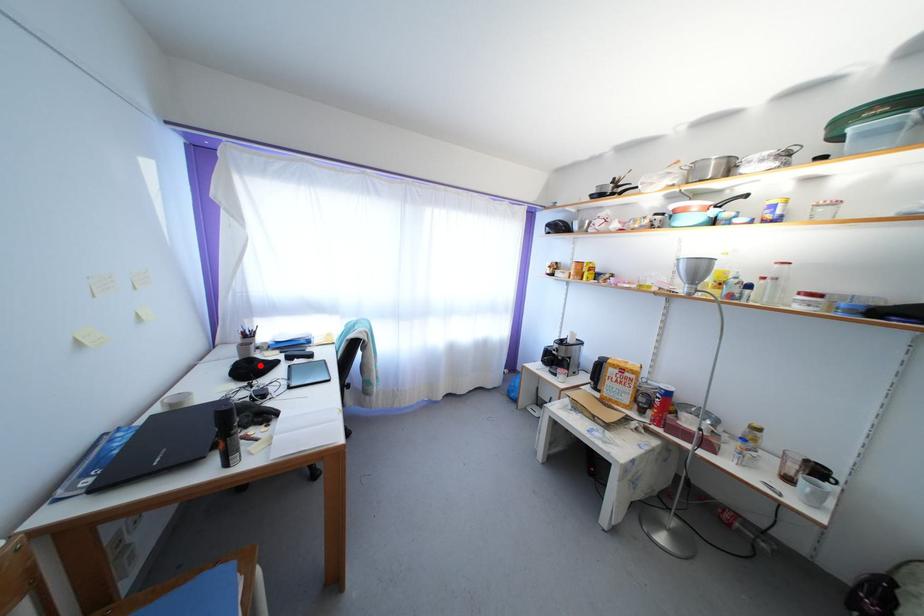
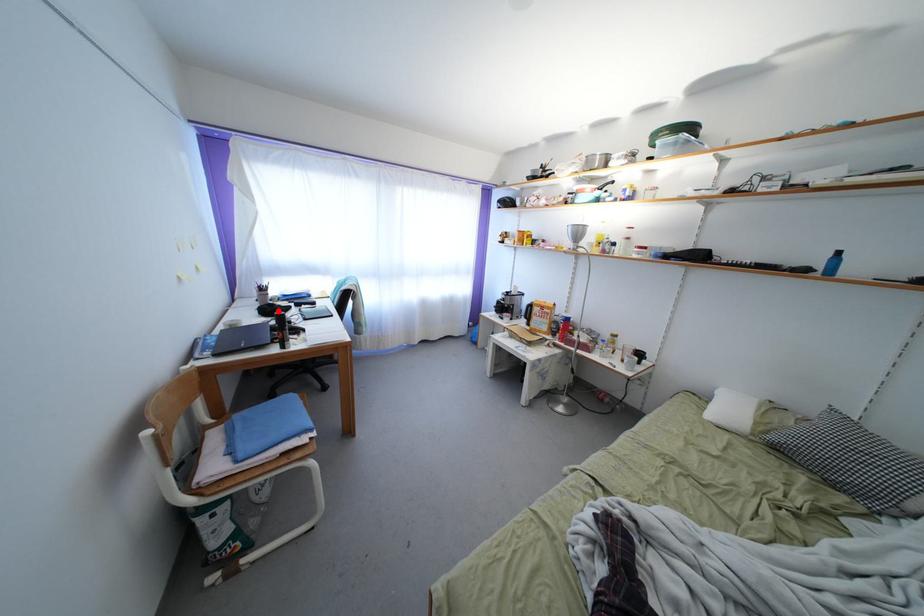
I am providing you with two images of the same scene from different viewpoints. A red point is marked on the first image and another point is marked on the second image. Is the red point in image1 aligned with the point shown in image2?

Yes